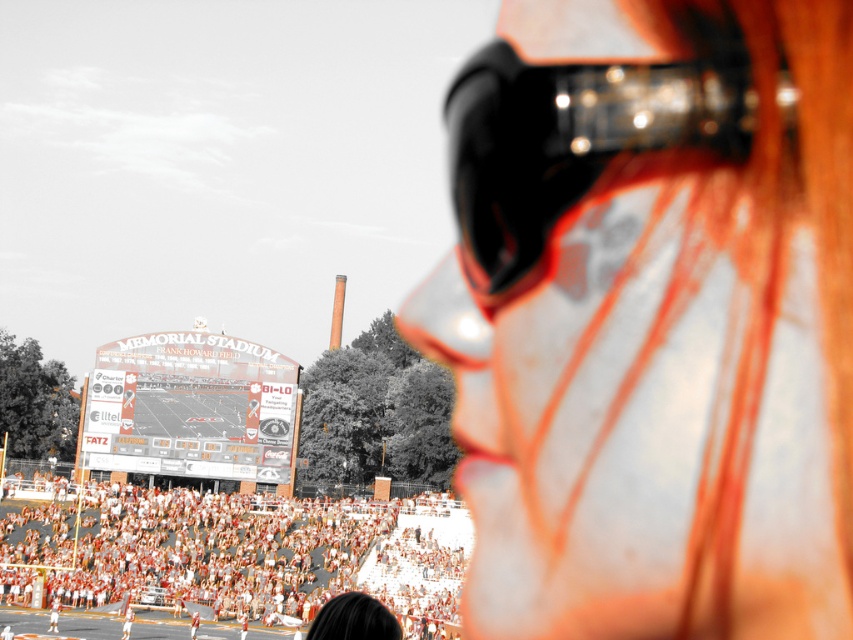
You are a photographer standing at the center of the football stadium. You notice a point at coordinate (x=239, y=556). Based on the scene description, can you determine if this point is located on the white fabric crowd at lower center or somewhere else?

The point at coordinate (x=239, y=556) is on the white fabric crowd at lower center, as stated in the objects description.

You are a photographer who wants to capture a closeup shot of the matte orange helmet at center without the black glossy goggles at upper right appearing in the frame. Based on their positions, is this possible?

The matte orange helmet at center is below the black glossy goggles at upper right, so it is possible to frame the shot to exclude the goggles by adjusting the camera angle to focus solely on the helmet.

You are a photographer at the stadium. You want to capture a photo where the matte orange helmet at center is clearly visible against the white fabric crowd at lower center. Based on the scene description, will the helmet stand out in the photo?

The matte orange helmet at center is above the white fabric crowd at lower center, so it will stand out due to its position and color contrast.